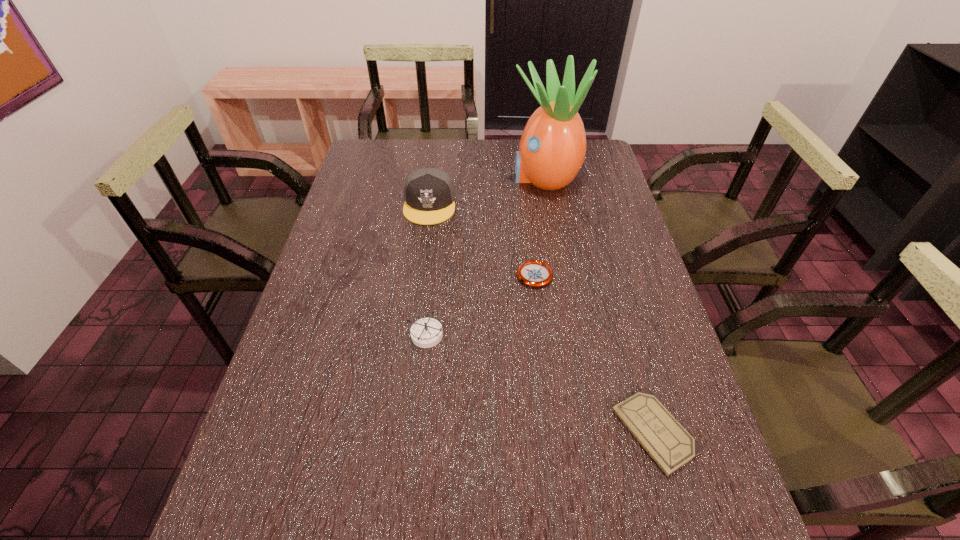
The height and width of the screenshot is (540, 960). In order to click on vacant space that satisfies the following two spatial constraints: 1. on the front-facing side of the right compass; 2. on the left side of the fourth shortest object in this screenshot , I will do `click(420, 275)`.